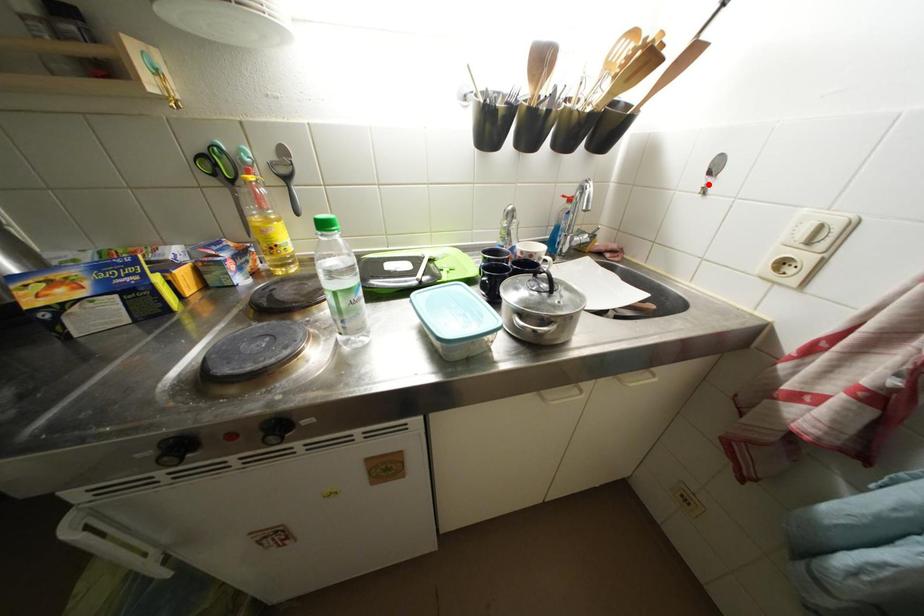
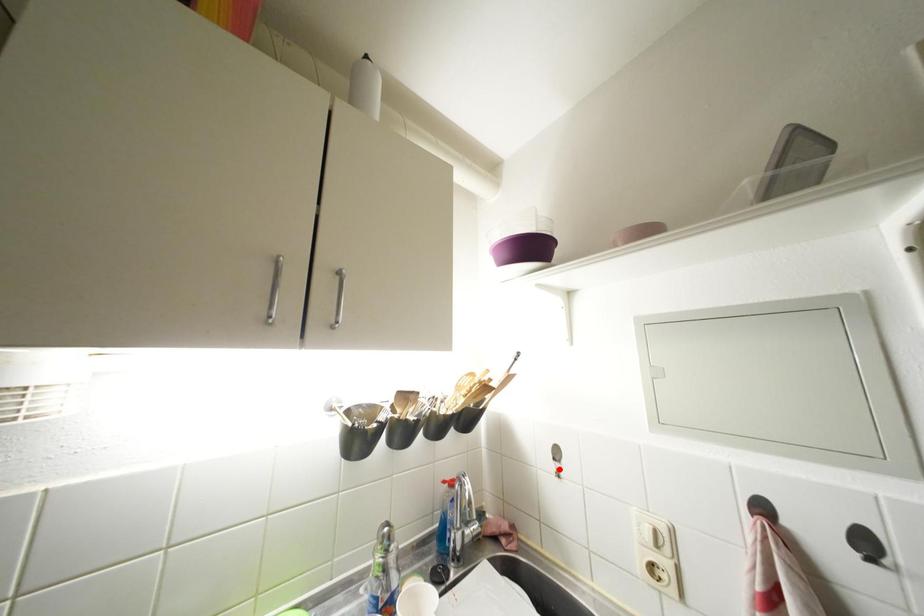
I am providing you with two images of the same scene from different viewpoints. A red point is marked on the first image and another point is marked on the second image. Is the marked point in image1 the same physical position as the marked point in image2?

Yes